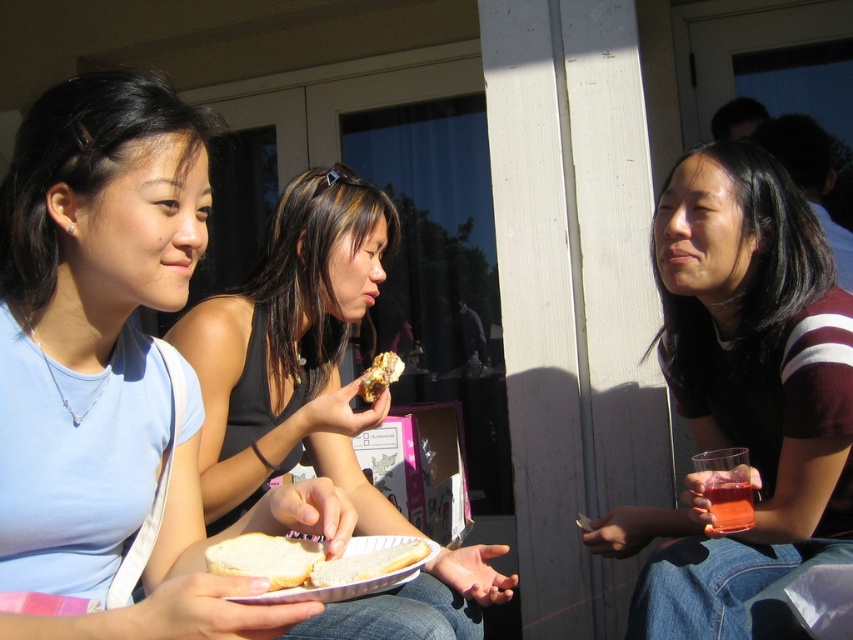
You are a photographer trying to capture a closeup shot of the white bread at center and the translucent glass cup at lower right. Since you want both items to appear similarly sized in the photo, which object should you move closer to the camera and which should you move farther away?

Since the white bread at center is wider than the translucent glass cup at lower right, to make them appear the same size in the photo, you should move the translucent glass cup at lower right closer to the camera and move the white bread at center farther away.

You are a photographer trying to capture a candid shot of the two people in the center of the image. The light blue cotton shirt at center and the matte black tank top at center are positioned in a way that might block each other. Based on their positions, which one is more likely to be visible in the photo if you aim your camera at the center?

The light blue cotton shirt at center is above the matte black tank top at center, so it will be more visible in the photo since it is positioned higher up.